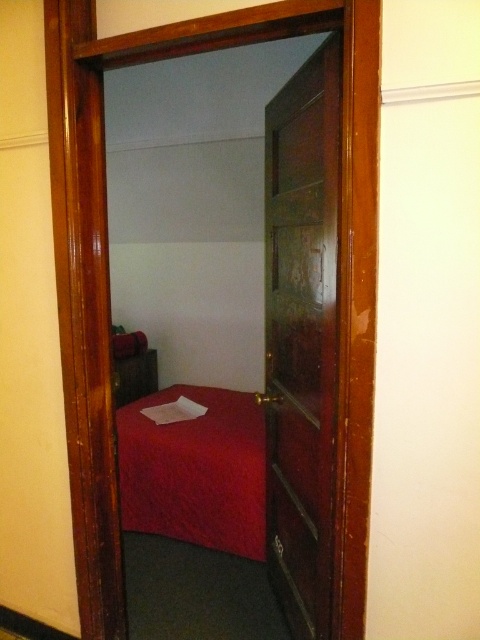
Based on the photo, does mahogany wood door at center appear under matte red bed at center?

No.

I want to click on mahogany wood door at center, so click(x=301, y=337).

Who is more distant from viewer, [277,572] or [157,426]?

Point [157,426]

The width and height of the screenshot is (480, 640). What are the coordinates of `mahogany wood door at center` in the screenshot? It's located at coord(301,337).